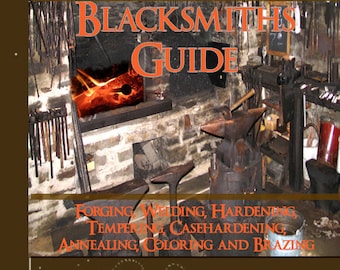
Locate an element on the screen. This screenshot has height=270, width=340. rack is located at coordinates (75, 144).